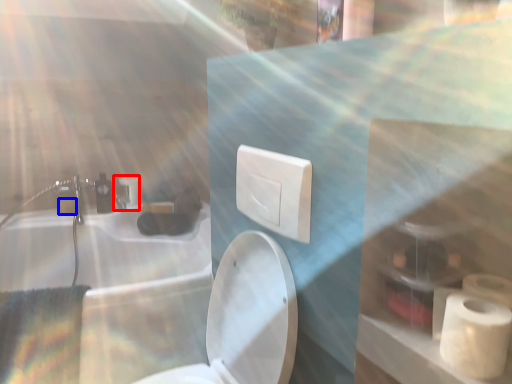
Question: Which point is further to the camera, faucet (highlighted by a red box) or toilet paper (highlighted by a blue box)?

Choices:
 (A) faucet
 (B) toilet paper

Answer: (A)